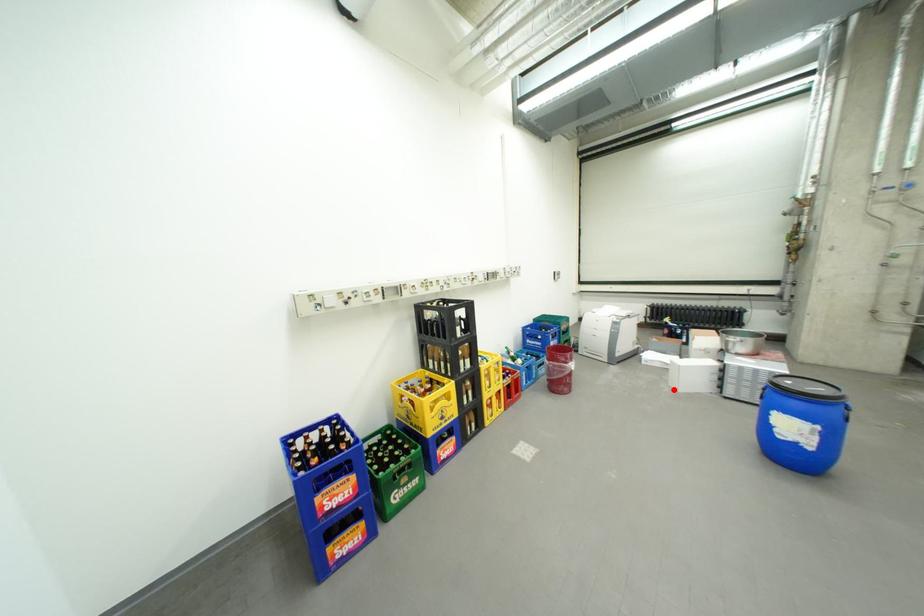
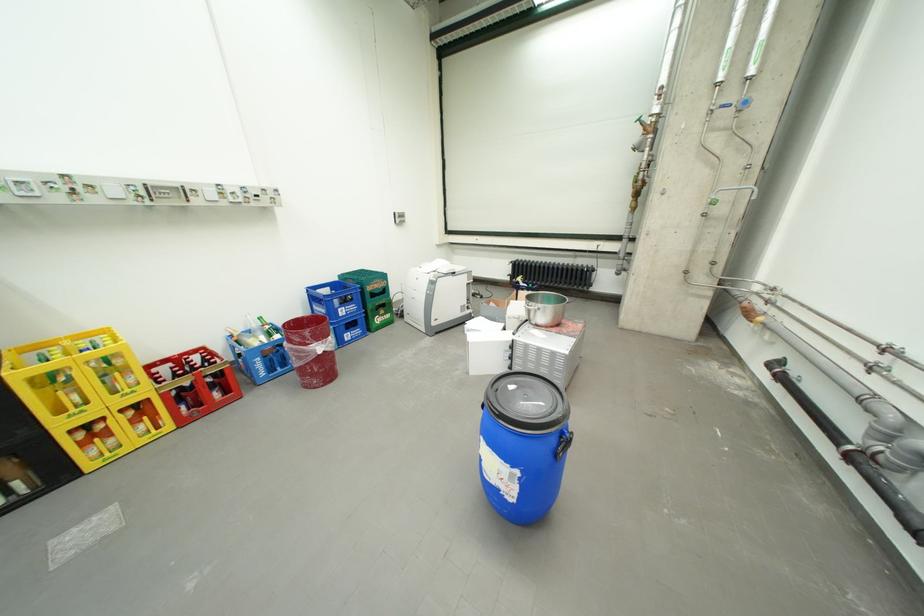
In the second image, find the point that corresponds to the highlighted location in the first image.

(468, 371)